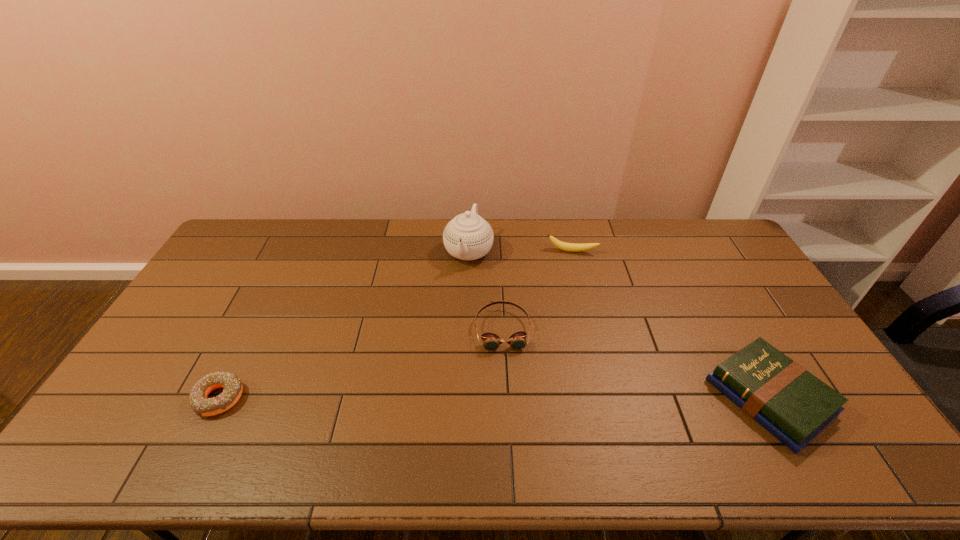
You are a GUI agent. You are given a task and a screenshot of the screen. Output one action in this format:
    pyautogui.click(x=<x>, y=<y>)
    Task: Click on the free space located through the lenses of the goggles
    The height and width of the screenshot is (540, 960).
    Given the screenshot: What is the action you would take?
    pyautogui.click(x=510, y=400)

Identify the location of vacant space located 0.150m on the upward curve of the second object from right to left. This screenshot has height=540, width=960. (566, 282).

Identify the location of free space located 0.140m on the upward curve of the second object from right to left. The image size is (960, 540). (566, 280).

Where is `vacant space positioned on the upward curve of the second object from right to left`? This screenshot has width=960, height=540. vacant space positioned on the upward curve of the second object from right to left is located at coordinates click(x=564, y=309).

Find the location of `free region located on the spout of the chinaware`. free region located on the spout of the chinaware is located at coordinates (448, 312).

Where is `vacant space situated 0.370m on the spout of the chinaware`? Image resolution: width=960 pixels, height=540 pixels. vacant space situated 0.370m on the spout of the chinaware is located at coordinates (432, 356).

Find the location of a particular element. The width and height of the screenshot is (960, 540). vacant space located 0.310m on the spout of the chinaware is located at coordinates (438, 340).

At what (x,y) coordinates should I click in order to perform the action: click on banana that is at the far edge. Please return your answer as a coordinate pair (x, y). The image size is (960, 540). Looking at the image, I should click on (569, 247).

Locate an element on the screen. chinaware that is positioned at the far edge is located at coordinates (468, 236).

Where is `doughnut that is at the near edge`? doughnut that is at the near edge is located at coordinates (232, 386).